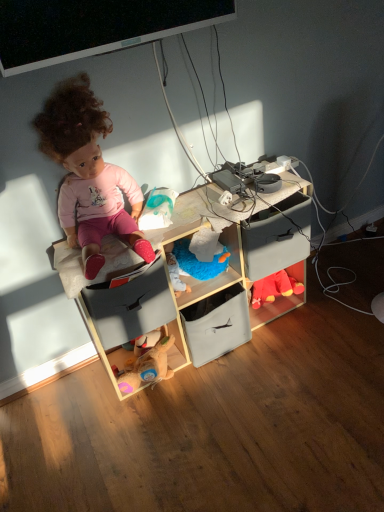
Locate an element on the screen. The width and height of the screenshot is (384, 512). vacant region in front of wooden cube at center, arranged as the 1th shelf when viewed from the left is located at coordinates (235, 429).